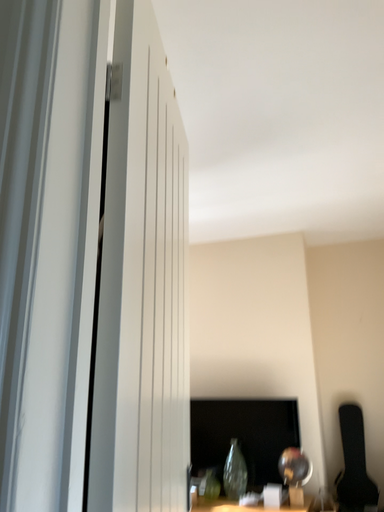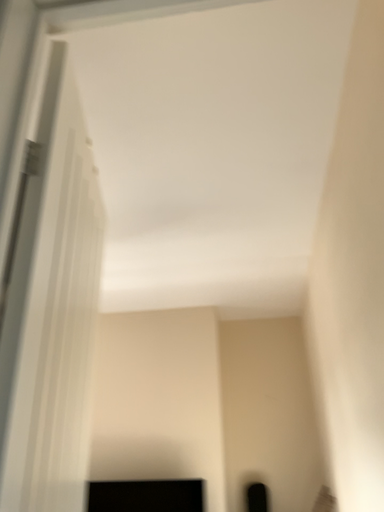
Question: How did the camera likely rotate when shooting the video?

Choices:
 (A) rotated right
 (B) rotated left

Answer: (A)